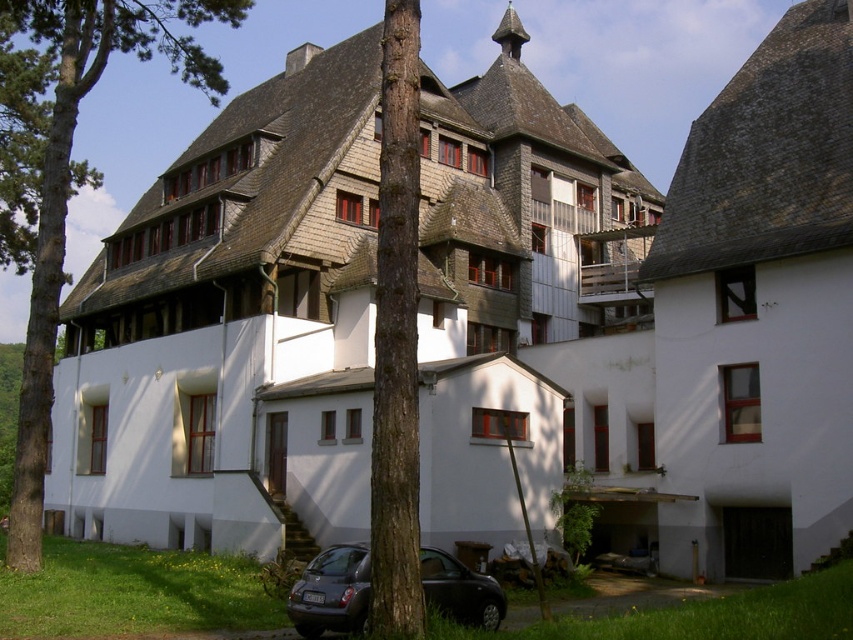
Question: Among these points, which one is nearest to the camera?

Choices:
 (A) (305, 627)
 (B) (405, 150)

Answer: (B)

Question: Can you confirm if green bark tree at left is smaller than metallic gray hatchback at lower center?

Choices:
 (A) no
 (B) yes

Answer: (A)

Question: From the image, what is the correct spatial relationship of brown rough bark tree at center in relation to metallic gray hatchback at lower center?

Choices:
 (A) below
 (B) above

Answer: (B)

Question: Which point appears farthest from the camera in this image?

Choices:
 (A) (413, 241)
 (B) (57, 209)

Answer: (B)

Question: Estimate the real-world distances between objects in this image. Which object is closer to the brown rough bark tree at center?

Choices:
 (A) green bark tree at left
 (B) metallic gray hatchback at lower center

Answer: (B)

Question: Is brown rough bark tree at center behind metallic gray hatchback at lower center?

Choices:
 (A) yes
 (B) no

Answer: (B)